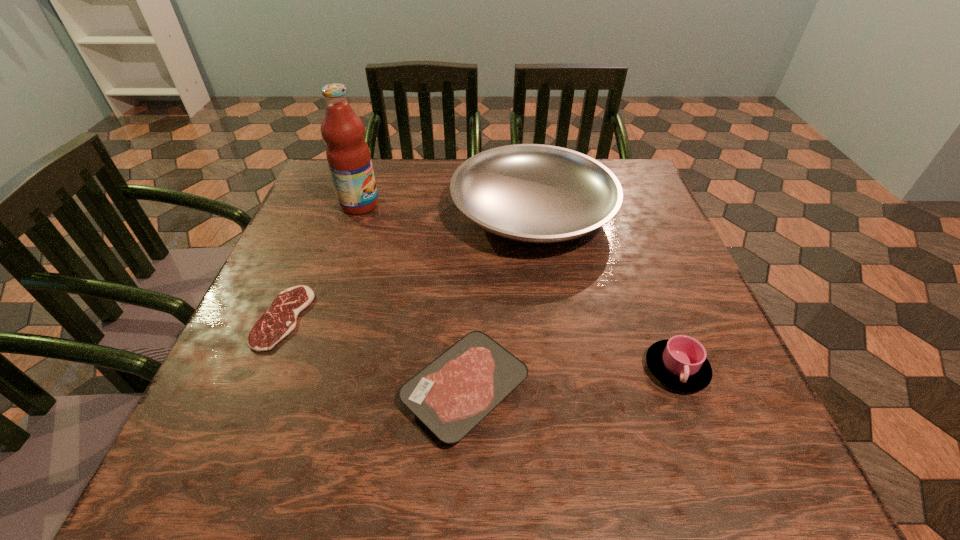
The width and height of the screenshot is (960, 540). In order to click on vacant region located 0.160m on the back of the shortest object in this screenshot , I will do `click(317, 238)`.

Locate an element on the screen. fruit juice that is positioned at the far edge is located at coordinates (348, 155).

Find the location of a particular element. The height and width of the screenshot is (540, 960). bedpan that is at the far edge is located at coordinates (533, 193).

You are a GUI agent. You are given a task and a screenshot of the screen. Output one action in this format:
    pyautogui.click(x=<x>, y=<y>)
    Task: Click on the object at the near edge
    
    Given the screenshot: What is the action you would take?
    (x=451, y=395)

Find the location of a particular element. This screenshot has width=960, height=540. fruit juice present at the left edge is located at coordinates (348, 155).

Where is `steak at the left edge`? This screenshot has height=540, width=960. steak at the left edge is located at coordinates (280, 319).

Identify the location of bedpan that is at the right edge. This screenshot has width=960, height=540. (533, 193).

I want to click on cup that is positioned at the right edge, so click(680, 363).

This screenshot has width=960, height=540. Find the location of `object situated at the far left corner`. object situated at the far left corner is located at coordinates (348, 155).

At what (x,y) coordinates should I click in order to perform the action: click on object situated at the far right corner. Please return your answer as a coordinate pair (x, y). The image size is (960, 540). Looking at the image, I should click on (533, 193).